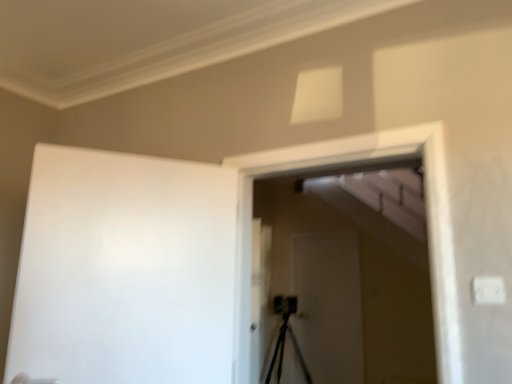
Question: Does white matte screen door at center, the second screen door viewed from the front, have a greater height compared to white matte screen door at center, the 2th screen door from the back?

Choices:
 (A) yes
 (B) no

Answer: (A)

Question: From the image's perspective, is white matte screen door at center, which appears as the first screen door when viewed from the back, beneath white matte screen door at center, marked as the 1th screen door in a front-to-back arrangement?

Choices:
 (A) no
 (B) yes

Answer: (B)

Question: Is white matte screen door at center, which appears as the first screen door when viewed from the back, wider than white matte screen door at center, the 2th screen door from the back?

Choices:
 (A) no
 (B) yes

Answer: (A)

Question: Are white matte screen door at center, the second screen door viewed from the front, and white matte screen door at center, marked as the 1th screen door in a front-to-back arrangement, making contact?

Choices:
 (A) yes
 (B) no

Answer: (B)

Question: Is white matte screen door at center, which appears as the first screen door when viewed from the back, bigger than white matte screen door at center, the 2th screen door from the back?

Choices:
 (A) no
 (B) yes

Answer: (A)

Question: From their relative heights in the image, would you say white matte barn door at left is taller or shorter than white matte screen door at center, the 2th screen door from the back?

Choices:
 (A) short
 (B) tall

Answer: (A)

Question: Does point (204, 274) appear closer or farther from the camera than point (253, 349)?

Choices:
 (A) closer
 (B) farther

Answer: (A)

Question: Would you say white matte barn door at left is to the left or to the right of white matte screen door at center, marked as the 1th screen door in a front-to-back arrangement, in the picture?

Choices:
 (A) right
 (B) left

Answer: (B)

Question: Is white matte barn door at left wider or thinner than white matte screen door at center, the 2th screen door from the back?

Choices:
 (A) thin
 (B) wide

Answer: (A)

Question: Would you say white matte screen door at center, which appears as the first screen door when viewed from the back, is inside or outside white matte barn door at left?

Choices:
 (A) inside
 (B) outside

Answer: (B)

Question: Is point (321, 372) positioned closer to the camera than point (153, 322)?

Choices:
 (A) closer
 (B) farther

Answer: (B)

Question: Looking at the image, does white matte screen door at center, the second screen door viewed from the front, seem bigger or smaller compared to white matte barn door at left?

Choices:
 (A) small
 (B) big

Answer: (A)

Question: Would you say white matte screen door at center, the second screen door viewed from the front, is to the left or to the right of white matte barn door at left in the picture?

Choices:
 (A) left
 (B) right

Answer: (B)

Question: Looking at their shapes, would you say white matte screen door at center, marked as the 1th screen door in a front-to-back arrangement, is wider or thinner than white matte screen door at center, the second screen door viewed from the front?

Choices:
 (A) thin
 (B) wide

Answer: (B)

Question: Which is correct: white matte screen door at center, marked as the 1th screen door in a front-to-back arrangement, is inside white matte screen door at center, the second screen door viewed from the front, or outside of it?

Choices:
 (A) inside
 (B) outside

Answer: (B)